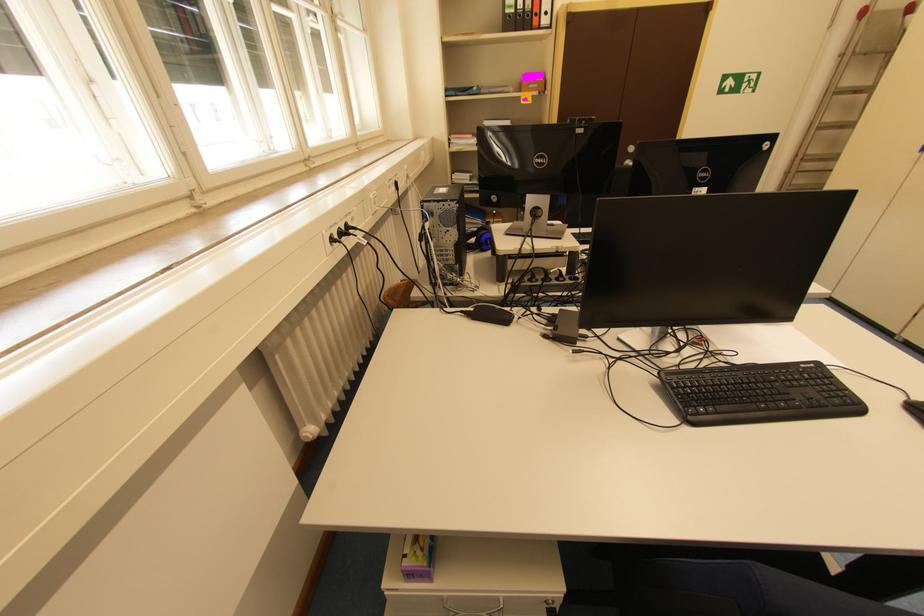
Which object does [915,408] point to?

This point indicates the black computer mouse.